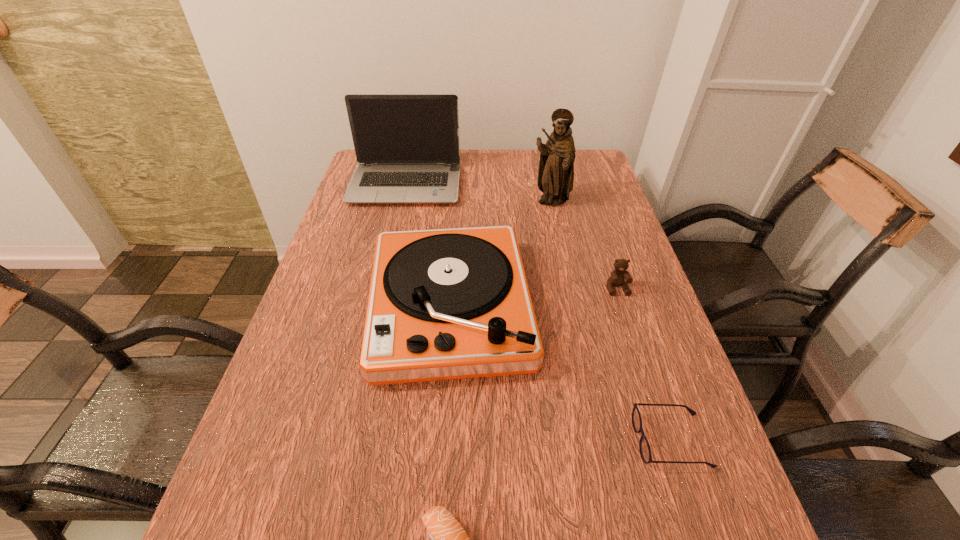
You are a GUI agent. You are given a task and a screenshot of the screen. Output one action in this format:
    pyautogui.click(x=<x>, y=<y>)
    Task: Click on the fourth object from left to right
    The height and width of the screenshot is (540, 960).
    Given the screenshot: What is the action you would take?
    pyautogui.click(x=556, y=165)

In order to click on laptop computer in this screenshot , I will do click(x=407, y=147).

Identify the location of record player. (443, 304).

You are a GUI agent. You are given a task and a screenshot of the screen. Output one action in this format:
    pyautogui.click(x=<x>, y=<y>)
    Task: Click on the third shortest object
    Image resolution: width=960 pixels, height=540 pixels.
    Given the screenshot: What is the action you would take?
    [x=619, y=277]

Where is `the second nearest object`? This screenshot has width=960, height=540. the second nearest object is located at coordinates (644, 447).

Locate an element on the screen. vacant space situated 0.120m on the front-facing side of the figurine is located at coordinates (558, 238).

Find the location of `vacant region located on the screen of the laptop computer`. vacant region located on the screen of the laptop computer is located at coordinates (398, 217).

Identify the location of free space located on the left of the third tallest object. (329, 307).

In order to click on blank area located on the face of the fourth tallest object in this screenshot , I will do `click(632, 335)`.

Image resolution: width=960 pixels, height=540 pixels. I want to click on vacant space located on the front-facing side of the spectacles, so click(x=415, y=441).